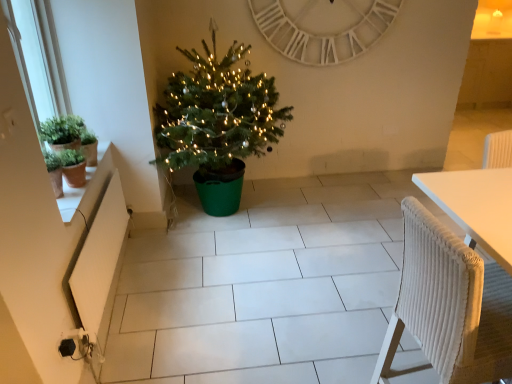
Question: Is point (105, 314) closer or farther from the camera than point (356, 16)?

Choices:
 (A) closer
 (B) farther

Answer: (A)

Question: Is white matte radiator at lower left taller or shorter than white wooden clock at upper center?

Choices:
 (A) tall
 (B) short

Answer: (B)

Question: Which object is the closest to the white matte radiator at lower left?

Choices:
 (A) green plastic christmas tree at center
 (B) white woven chair at right
 (C) terracotta clay pot at left
 (D) green matte pot at left
 (E) white wooden clock at upper center

Answer: (C)

Question: Which of these objects is positioned closest to the terracotta clay pot at left?

Choices:
 (A) white wooden clock at upper center
 (B) white woven chair at right
 (C) green matte pot at left
 (D) green plastic christmas tree at center
 (E) white matte radiator at lower left

Answer: (C)